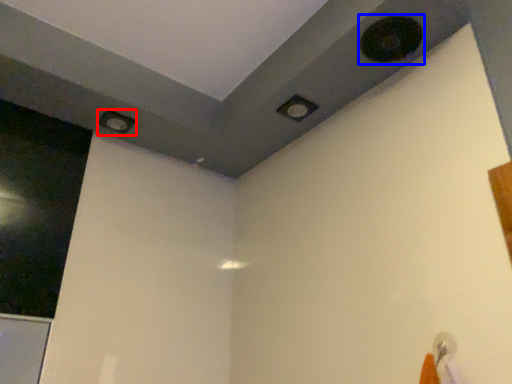
Question: Which object is closer to the camera taking this photo, hole (highlighted by a red box) or hole (highlighted by a blue box)?

Choices:
 (A) hole
 (B) hole

Answer: (B)